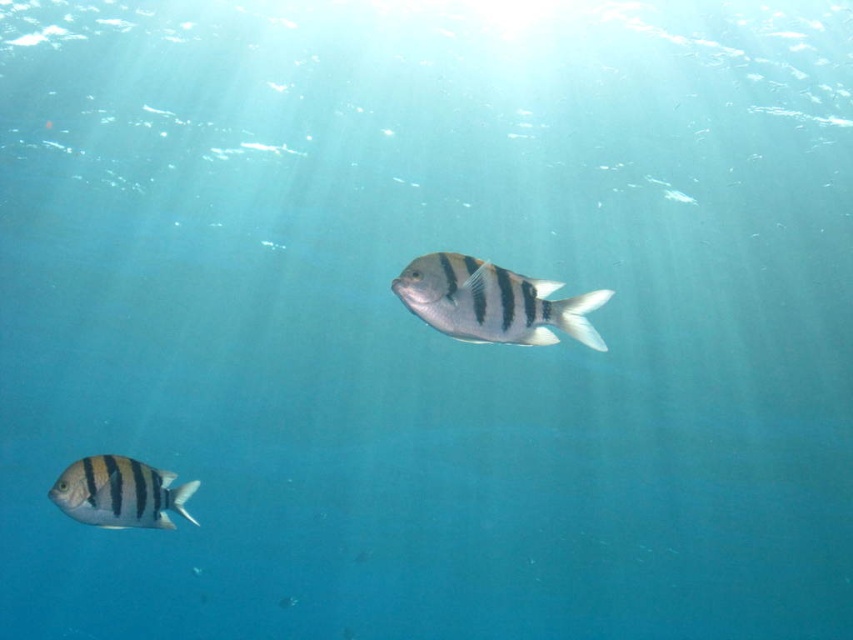
From the picture: You are a marine biologist observing the underwater scene. You notice the silver metallic fish at center and the striped matte fish at lower left. Which fish takes up more space in the image?

The striped matte fish at lower left takes up more space in the image than the silver metallic fish at center, as stated in the description.

You are a scuba diver with a 3.5 feet long underwater camera. You want to take a photo of the point at coordinates point (486, 300). Can your camera reach that point from your current position?

The distance between you and point (486, 300) is 4.13 feet, which is longer than your camera length of 3.5 feet. Therefore, the camera cannot reach the point.

Looking at this image, you are a marine biologist observing two fish in an underwater scene. You need to identify which fish has a narrower body. The fish are the silver metallic fish at center and the striped matte fish at lower left. Can you determine which one is thinner?

The silver metallic fish at center is thinner than the striped matte fish at lower left, so the silver metallic fish at center has a narrower body.